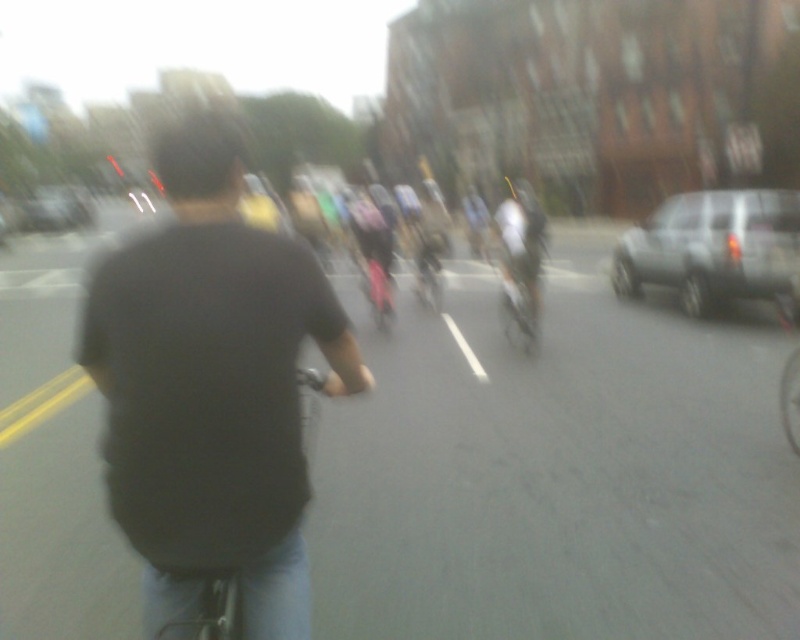
You are a photographer trying to focus on the black matte shirt at center in the image. What are the exact coordinates where you should aim your camera lens?

The black matte shirt at center is located at coordinates point (212, 388).

You are a photographer trying to capture a clear photo of the black matte bicycle at center and the silver metallic bicycle at center. Since the image is slightly blurred, you want to adjust your camera settings to reduce motion blur. Which bicycle should you focus on to ensure clarity, considering their sizes?

The black matte bicycle at center is larger in size compared to the silver metallic bicycle at center. To reduce motion blur, focus on the larger black matte bicycle at center as it will occupy more of the frame, making it easier to adjust settings for clarity.